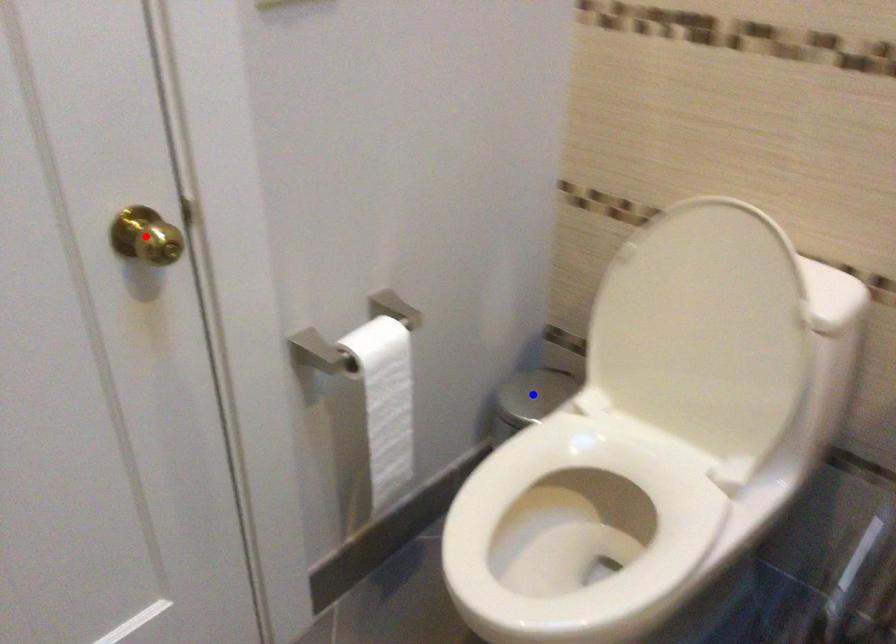
Question: In the image, two points are highlighted. Which point is nearer to the camera? Reply with the corresponding letter.

Choices:
 (A) blue point
 (B) red point

Answer: (B)